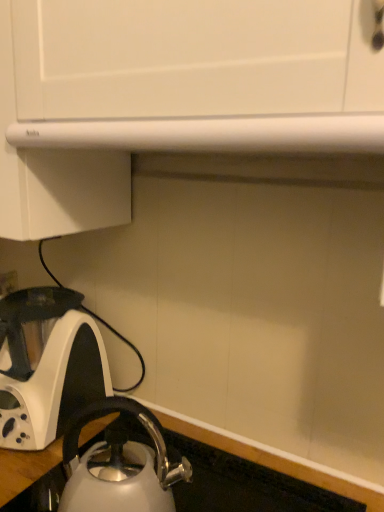
Question: From a real-world perspective, relative to satin silver kettle at lower left, which appears as the first kettle when viewed from the right, is white glossy countertop at lower left vertically above or below?

Choices:
 (A) below
 (B) above

Answer: (A)

Question: Considering their positions, is white glossy countertop at lower left located in front of or behind satin silver kettle at lower left, positioned as the 1th kettle in front-to-back order?

Choices:
 (A) behind
 (B) front

Answer: (B)

Question: Estimate the real-world distances between objects in this image. Which object is farther from the white glossy kettle at lower left, which appears as the 2th kettle when viewed from the front?

Choices:
 (A) satin silver kettle at lower left, which appears as the first kettle when viewed from the right
 (B) white glossy countertop at lower left

Answer: (B)

Question: Which is farther from the white glossy countertop at lower left?

Choices:
 (A) white glossy kettle at lower left, arranged as the first kettle when viewed from the left
 (B) satin silver kettle at lower left, marked as the second kettle in a back-to-front arrangement

Answer: (A)